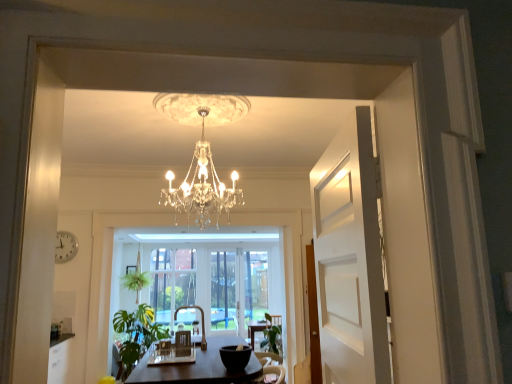
Question: Is green leafy plant at lower center, acting as the 2th plant starting from the left, in front of green leafy plant at lower left?

Choices:
 (A) yes
 (B) no

Answer: (B)

Question: From a real-world perspective, is green leafy plant at lower center, the 1th plant positioned from the right, below green leafy plant at lower left?

Choices:
 (A) yes
 (B) no

Answer: (A)

Question: Is green leafy plant at lower center, the 1th plant positioned from the right, at the left side of green leafy plant at lower left?

Choices:
 (A) no
 (B) yes

Answer: (A)

Question: Can you confirm if green leafy plant at lower center, which appears as the 2th plant when viewed from the back, is thinner than green leafy plant at lower left?

Choices:
 (A) yes
 (B) no

Answer: (A)

Question: Are green leafy plant at lower center, acting as the 2th plant starting from the left, and green leafy plant at lower left beside each other?

Choices:
 (A) yes
 (B) no

Answer: (B)

Question: Is point (175, 337) closer or farther from the camera than point (315, 231)?

Choices:
 (A) closer
 (B) farther

Answer: (B)

Question: From the image's perspective, is matte black armchair at center, which is the 3th armchair in back-to-front order, positioned above or below white wooden door at right?

Choices:
 (A) above
 (B) below

Answer: (B)

Question: In the image, is matte black armchair at center, the 1th armchair viewed from the front, on the left side or the right side of white wooden door at right?

Choices:
 (A) right
 (B) left

Answer: (B)

Question: Choose the correct answer: Is matte black armchair at center, which is the 3th armchair in back-to-front order, inside white wooden door at right or outside it?

Choices:
 (A) inside
 (B) outside

Answer: (B)

Question: Considering the positions of green leafy plant at center, arranged as the 2th plant when viewed from the front, and matte black armchair at center, the 1th armchair viewed from the front, in the image, is green leafy plant at center, arranged as the 2th plant when viewed from the front, taller or shorter than matte black armchair at center, the 1th armchair viewed from the front,?

Choices:
 (A) short
 (B) tall

Answer: (B)

Question: Would you say green leafy plant at center, the first plant from the left, is to the left or to the right of matte black armchair at center, the 1th armchair viewed from the front, in the picture?

Choices:
 (A) left
 (B) right

Answer: (A)

Question: From the image's perspective, is green leafy plant at center, arranged as the 2th plant when viewed from the front, positioned above or below matte black armchair at center, the 1th armchair viewed from the front?

Choices:
 (A) above
 (B) below

Answer: (B)

Question: Would you say green leafy plant at center, placed as the second plant when sorted from right to left, is inside or outside matte black armchair at center, which is the 3th armchair in back-to-front order?

Choices:
 (A) inside
 (B) outside

Answer: (B)

Question: From the image's perspective, is wooden armchair at center, the first armchair when ordered from back to front, located above or below green leafy plant at center, the 1th plant from the back?

Choices:
 (A) above
 (B) below

Answer: (A)

Question: Is wooden armchair at center, the third armchair positioned from the front, inside or outside of green leafy plant at center, arranged as the 2th plant when viewed from the front?

Choices:
 (A) outside
 (B) inside

Answer: (A)